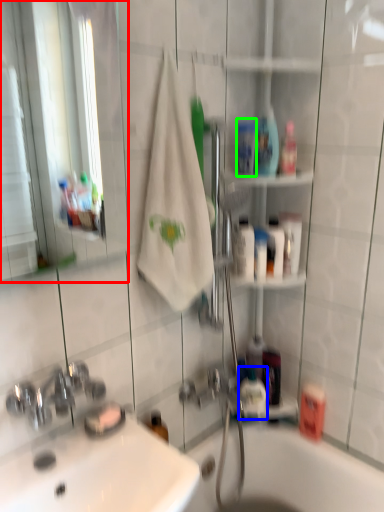
Question: Estimate the real-world distances between objects in this image. Which object is closer to mirror (highlighted by a red box), mouthwash (highlighted by a blue box) or mouthwash (highlighted by a green box)?

Choices:
 (A) mouthwash
 (B) mouthwash

Answer: (B)